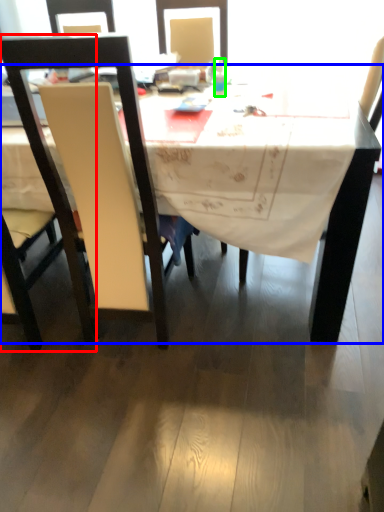
Question: Based on their relative distances, which object is farther from chair (highlighted by a red box)? Choose from desk (highlighted by a blue box) and bottle (highlighted by a green box).

Choices:
 (A) desk
 (B) bottle

Answer: (A)